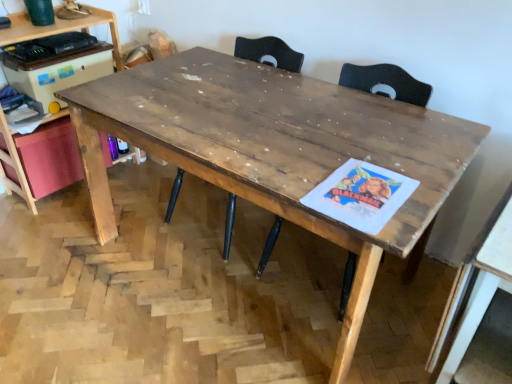
Identify the location of blank area to the left of wooden table at center, placed as the 1th table when sorted from left to right. (80, 276).